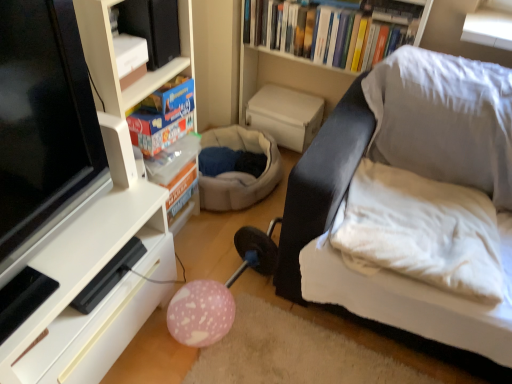
You are a GUI agent. You are given a task and a screenshot of the screen. Output one action in this format:
    pyautogui.click(x=<x>, y=<y>)
    Task: Click on the blank space situated above pink matte balloon at lower center (from a real-world perspective)
    This screenshot has width=512, height=384.
    Given the screenshot: What is the action you would take?
    pyautogui.click(x=202, y=297)